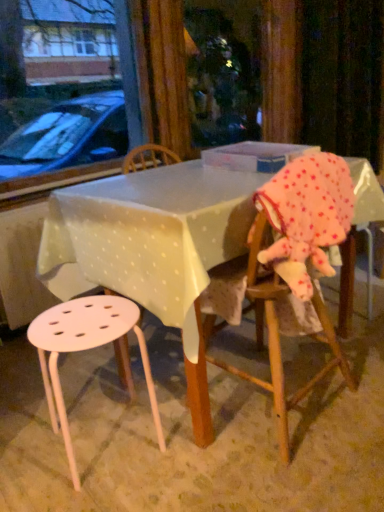
At what (x,y) coordinates should I click in order to perform the action: click on free space to the left of translucent plastic box at center. Please return your answer as a coordinate pair (x, y). This screenshot has height=512, width=384. Looking at the image, I should click on (172, 174).